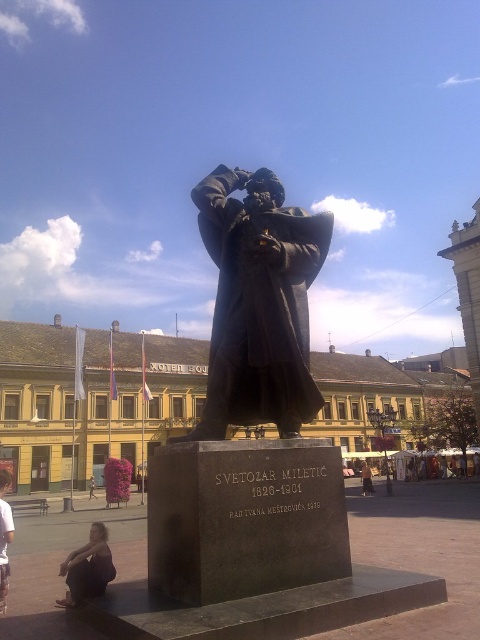
This screenshot has height=640, width=480. What do you see at coordinates (87, 568) in the screenshot?
I see `dark hair human at lower left` at bounding box center [87, 568].

Which is below, dark hair human at lower left or light brown wooden bench at center?

light brown wooden bench at center

Locate an element on the screen. The image size is (480, 640). dark hair human at lower left is located at coordinates (87, 568).

Looking at this image, can you confirm if bronze statue at center is wider than light brown wooden bench at center?

Yes.

Does bronze statue at center have a greater height compared to light brown wooden bench at center?

Yes.

The height and width of the screenshot is (640, 480). What are the coordinates of `bronze statue at center` in the screenshot? It's located at (259, 304).

The image size is (480, 640). I want to click on bronze statue at center, so click(x=259, y=304).

Is yellow painted building at center taller than dark brown leather jacket at lower left?

Indeed, yellow painted building at center has a greater height compared to dark brown leather jacket at lower left.

Does yellow painted building at center have a larger size compared to dark brown leather jacket at lower left?

Yes.

Which is in front, point (424, 403) or point (94, 483)?

Point (94, 483) is in front.

Find the location of a particular element. This screenshot has width=480, height=640. yellow painted building at center is located at coordinates (91, 400).